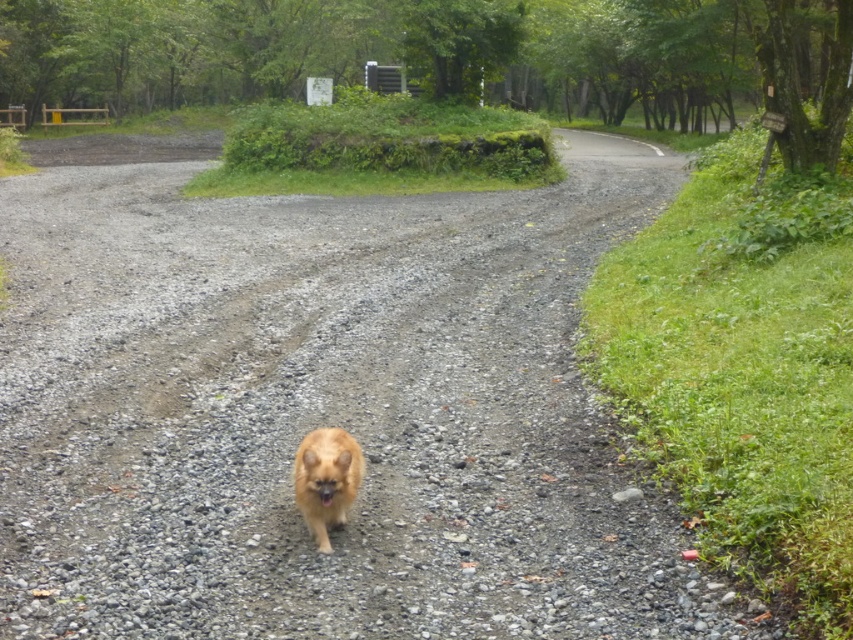
Question: Which point is closer to the camera?

Choices:
 (A) coord(329,394)
 (B) coord(329,502)

Answer: (B)

Question: Can you confirm if gray gravel at center is positioned to the left of golden fur dog at center?

Choices:
 (A) no
 (B) yes

Answer: (B)

Question: Considering the relative positions of gray gravel at center and golden fur dog at center in the image provided, where is gray gravel at center located with respect to golden fur dog at center?

Choices:
 (A) above
 (B) below

Answer: (A)

Question: Does gray gravel at center appear on the left side of golden fur dog at center?

Choices:
 (A) no
 (B) yes

Answer: (B)

Question: Which point is closer to the camera taking this photo?

Choices:
 (A) (329, 454)
 (B) (6, 564)

Answer: (B)